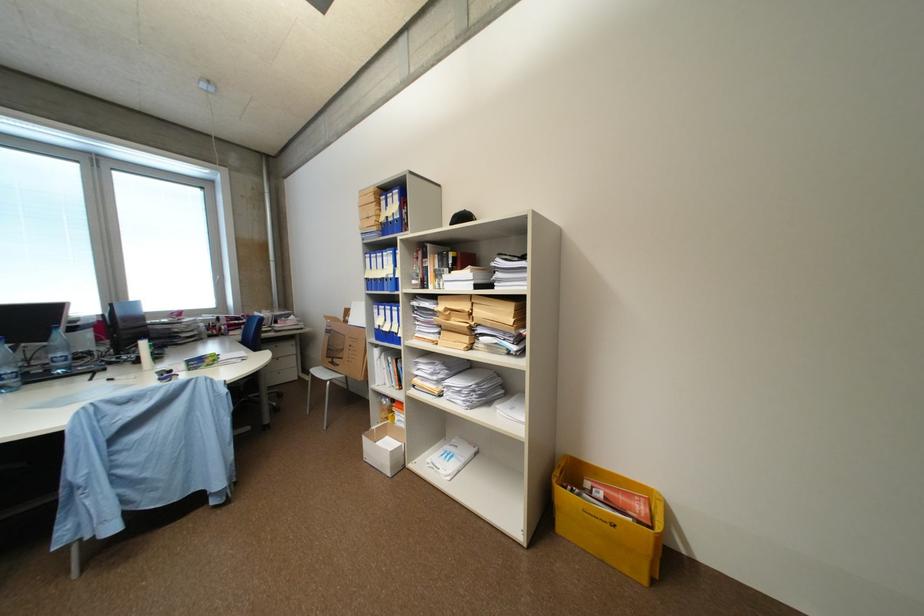
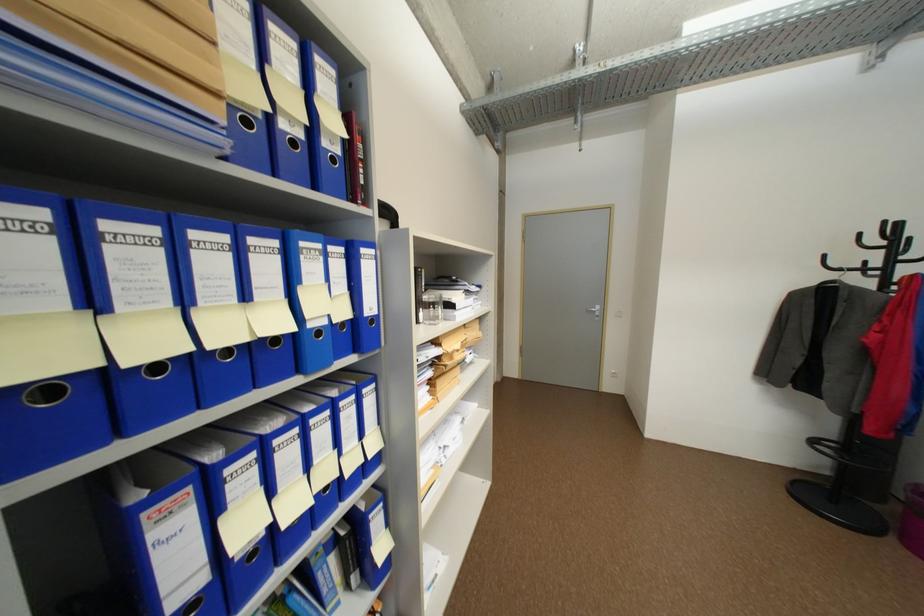
Find the pixel in the second image that matches [383,281] in the first image.

(164, 368)